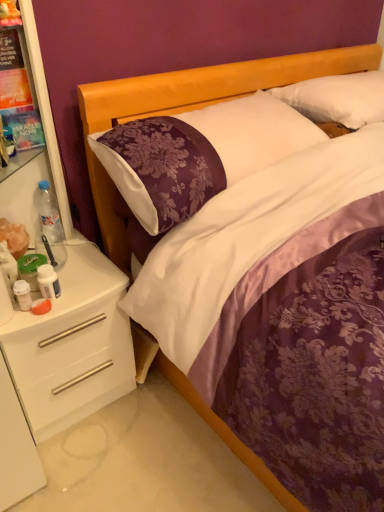
Question: In terms of height, does white glossy drawer at lower left look taller or shorter compared to purple satin pillow at center, which is the 2th pillow from right to left?

Choices:
 (A) short
 (B) tall

Answer: (B)

Question: Would you say white glossy drawer at lower left is inside or outside purple satin pillow at center, which is the 2th pillow from right to left?

Choices:
 (A) outside
 (B) inside

Answer: (A)

Question: Which of these objects is positioned farthest from the white soft pillow at upper right, which is the 1th pillow from right to left?

Choices:
 (A) purple satin bed at center
 (B) clear plastic bottle at left, the 3th bottle from the bottom
 (C) white plastic shelf at left
 (D) white glossy drawer at lower left
 (E) white plastic bottle at left, which is counted as the second bottle, starting from the bottom

Answer: (E)

Question: Which object is positioned closest to the white glossy drawer at lower left?

Choices:
 (A) purple satin pillow at center, which is the 2th pillow from right to left
 (B) white soft pillow at upper right, which is the 1th pillow from right to left
 (C) clear plastic bottle at left, positioned as the first bottle in top-to-bottom order
 (D) purple satin bed at center
 (E) clear plastic bottle at left, which is the 1th bottle from front to back

Answer: (E)